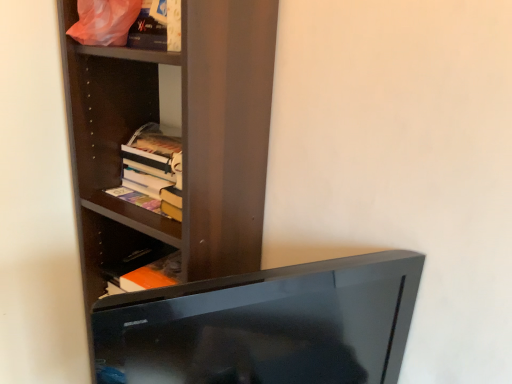
What do you see at coordinates (266, 325) in the screenshot? I see `black glossy tv at lower center` at bounding box center [266, 325].

The width and height of the screenshot is (512, 384). Describe the element at coordinates (195, 137) in the screenshot. I see `dark wood shelf at upper left` at that location.

Identify the location of matte plastic bag at upper left. point(132,54).

From the image's perspective, who appears lower, black glossy tv at lower center or dark wood shelf at upper left?

From the image's view, black glossy tv at lower center is below.

Considering the relative sizes of black glossy tv at lower center and dark wood shelf at upper left in the image provided, is black glossy tv at lower center taller than dark wood shelf at upper left?

→ No.

How different are the orientations of black glossy tv at lower center and dark wood shelf at upper left in degrees?

black glossy tv at lower center and dark wood shelf at upper left are facing 60.4 degrees away from each other.

Which object is thinner, black glossy tv at lower center or dark wood shelf at upper left?

black glossy tv at lower center is thinner.

Is matte plastic bag at upper left facing away from black glossy tv at lower center?

No, matte plastic bag at upper left's orientation is not away from black glossy tv at lower center.

Between point (88, 51) and point (295, 345), which one is positioned in front?

The point (295, 345) is closer.

Consider the image. Which object is further away from the camera taking this photo, matte plastic bag at upper left or black glossy tv at lower center?

matte plastic bag at upper left is behind.

Who is taller, matte plastic bag at upper left or black glossy tv at lower center?

Standing taller between the two is black glossy tv at lower center.

Where is `shelf located on the right of hardcover books at center-left`? The width and height of the screenshot is (512, 384). shelf located on the right of hardcover books at center-left is located at coordinates (195, 137).

From a real-world perspective, is hardcover books at center-left beneath dark wood shelf at upper left?

No, from a real-world perspective, hardcover books at center-left is not under dark wood shelf at upper left.

Consider the image. From their relative heights in the image, would you say hardcover books at center-left is taller or shorter than dark wood shelf at upper left?

Clearly, hardcover books at center-left is shorter compared to dark wood shelf at upper left.

Considering the points (167, 147) and (202, 83), which point is behind, point (167, 147) or point (202, 83)?

Positioned behind is point (167, 147).

Considering the positions of objects dark wood shelf at upper left and hardcover books at center-left in the image provided, who is more to the left, dark wood shelf at upper left or hardcover books at center-left?

From the viewer's perspective, hardcover books at center-left appears more on the left side.

Where is `book on the left of dark wood shelf at upper left`? The image size is (512, 384). book on the left of dark wood shelf at upper left is located at coordinates (152, 171).

Is dark wood shelf at upper left bigger than hardcover books at center-left?

Indeed, dark wood shelf at upper left has a larger size compared to hardcover books at center-left.

Is point (125, 207) closer or farther from the camera than point (140, 147)?

Point (125, 207).

What's the angular difference between hardcover books at center-left and black glossy tv at lower center's facing directions?

There is a 59.8-degree angle between the facing directions of hardcover books at center-left and black glossy tv at lower center.

The height and width of the screenshot is (384, 512). In the image, there is a black glossy tv at lower center. Identify the location of book above it (from the image's perspective). pos(152,171).

Are hardcover books at center-left and black glossy tv at lower center located far from each other?

No, hardcover books at center-left is in close proximity to black glossy tv at lower center.

Is point (134, 148) behind point (329, 319)?

Yes.

Which of these two, matte plastic bag at upper left or dark wood shelf at upper left, stands taller?

Standing taller between the two is dark wood shelf at upper left.

From a real-world perspective, who is located lower, matte plastic bag at upper left or dark wood shelf at upper left?

dark wood shelf at upper left, from a real-world perspective.

Is dark wood shelf at upper left at the back of matte plastic bag at upper left?

Yes, matte plastic bag at upper left's orientation is away from dark wood shelf at upper left.

Is matte plastic bag at upper left wider or thinner than dark wood shelf at upper left?

Clearly, matte plastic bag at upper left has less width compared to dark wood shelf at upper left.

How different are the orientations of dark wood shelf at upper left and black glossy tv at lower center in degrees?

The angular difference between dark wood shelf at upper left and black glossy tv at lower center is 60.4 degrees.

Considering the sizes of objects dark wood shelf at upper left and black glossy tv at lower center in the image provided, who is thinner, dark wood shelf at upper left or black glossy tv at lower center?

With smaller width is black glossy tv at lower center.

Is dark wood shelf at upper left turned away from black glossy tv at lower center?

dark wood shelf at upper left is not turned away from black glossy tv at lower center.

The image size is (512, 384). I want to click on television below the dark wood shelf at upper left (from the image's perspective), so click(266, 325).

Identify the location of cabinet that is on the left side of black glossy tv at lower center. The image size is (512, 384). (132, 54).

From the image, which object appears to be nearer to hardcover books at center-left, dark wood shelf at upper left or black glossy tv at lower center?

dark wood shelf at upper left is closer to hardcover books at center-left.

From the image, which object appears to be farther from matte plastic bag at upper left, hardcover books at center-left or black glossy tv at lower center?

black glossy tv at lower center.

Based on their spatial positions, is hardcover books at center-left or dark wood shelf at upper left closer to black glossy tv at lower center?

Among the two, dark wood shelf at upper left is located nearer to black glossy tv at lower center.

Considering their positions, is black glossy tv at lower center positioned closer to matte plastic bag at upper left than dark wood shelf at upper left?

Based on the image, dark wood shelf at upper left appears to be nearer to matte plastic bag at upper left.

Considering their positions, is dark wood shelf at upper left positioned closer to black glossy tv at lower center than matte plastic bag at upper left?

dark wood shelf at upper left is positioned closer to the anchor black glossy tv at lower center.

When comparing their distances from hardcover books at center-left, does matte plastic bag at upper left or dark wood shelf at upper left seem closer?

Among the two, dark wood shelf at upper left is located nearer to hardcover books at center-left.

From the image, which object appears to be farther from dark wood shelf at upper left, hardcover books at center-left or black glossy tv at lower center?

black glossy tv at lower center is further to dark wood shelf at upper left.

Based on their spatial positions, is matte plastic bag at upper left or dark wood shelf at upper left further from black glossy tv at lower center?

matte plastic bag at upper left lies further to black glossy tv at lower center than the other object.

The height and width of the screenshot is (384, 512). Identify the location of book between matte plastic bag at upper left and dark wood shelf at upper left in the up-down direction. (152, 171).

The height and width of the screenshot is (384, 512). Identify the location of book that lies between matte plastic bag at upper left and black glossy tv at lower center from top to bottom. (152, 171).

Locate an element on the screen. shelf that lies between matte plastic bag at upper left and black glossy tv at lower center from top to bottom is located at coordinates (195, 137).

This screenshot has width=512, height=384. In order to click on shelf that lies between hardcover books at center-left and black glossy tv at lower center from top to bottom in this screenshot , I will do tap(195, 137).